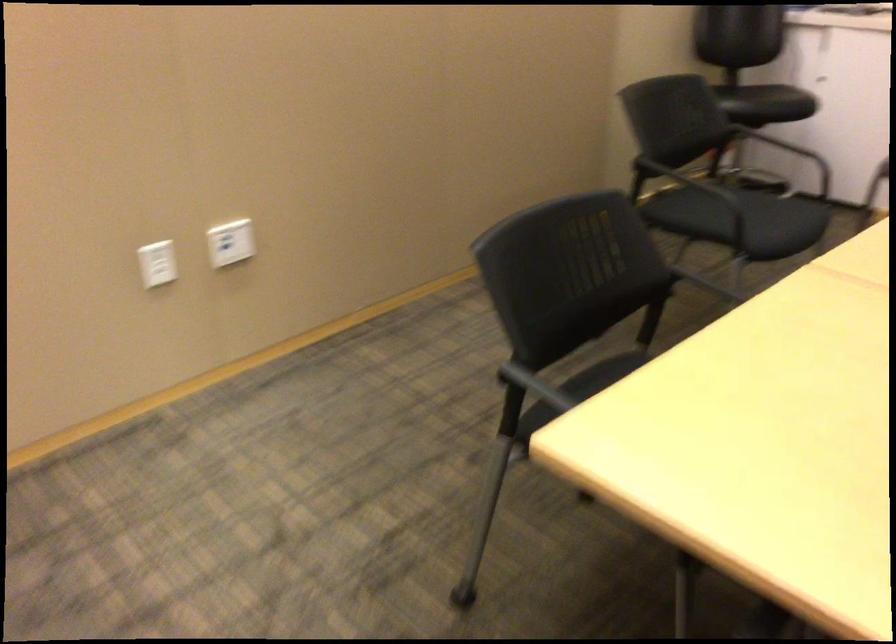
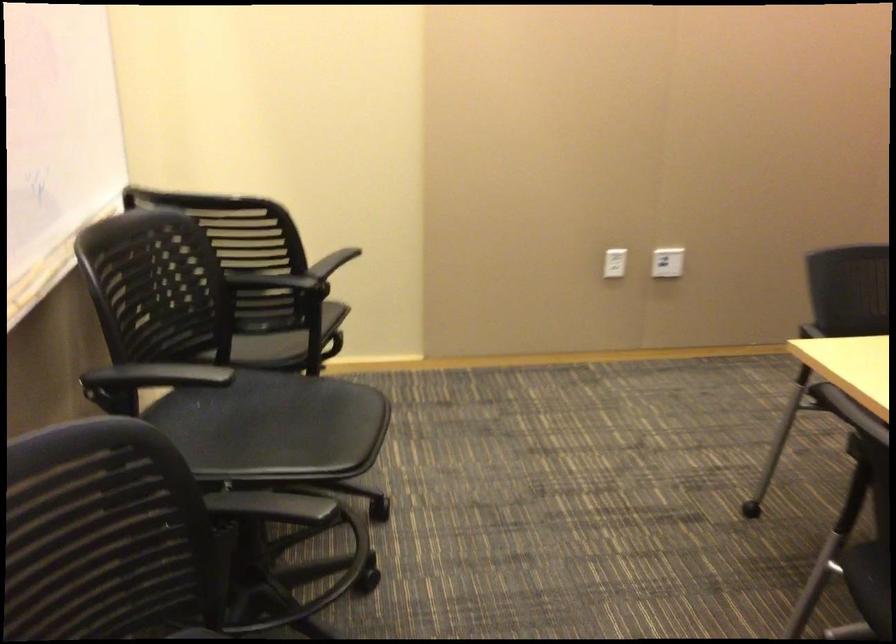
Find the pixel in the second image that matches point 152,277 in the first image.

(615, 263)